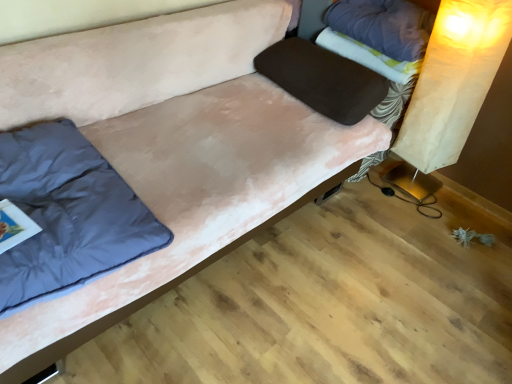
At what (x,y) coordinates should I click in order to perform the action: click on free space that is to the left of matte paper lampshade at right. Please return your answer as a coordinate pair (x, y). The image size is (512, 384). Looking at the image, I should click on (365, 188).